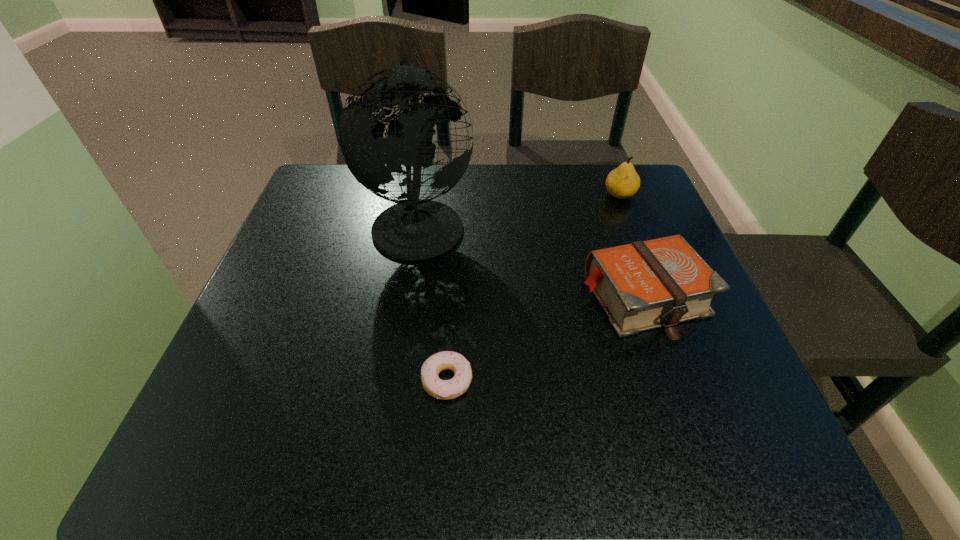
Locate an element on the screen. the tallest object is located at coordinates (x=413, y=229).

Locate an element on the screen. pear is located at coordinates (623, 182).

Find the location of a particular element. Bible is located at coordinates (643, 285).

This screenshot has width=960, height=540. Find the location of `the nearest object`. the nearest object is located at coordinates (449, 389).

You are a GUI agent. You are given a task and a screenshot of the screen. Output one action in this format:
    pyautogui.click(x=<x>, y=<y>)
    Task: Click on the doughnut
    This screenshot has width=960, height=540.
    Given the screenshot: What is the action you would take?
    pyautogui.click(x=449, y=389)

Locate an element on the screen. free space located on the front-facing side of the globe is located at coordinates (640, 222).

Find the location of a particular element. free space located 0.080m on the left of the second tallest object is located at coordinates (572, 195).

Locate an element on the screen. Image resolution: width=960 pixels, height=540 pixels. free space located 0.090m on the back of the Bible is located at coordinates (621, 233).

You are a GUI agent. You are given a task and a screenshot of the screen. Output one action in this format:
    pyautogui.click(x=<x>, y=<y>)
    Task: Click on the free region located 0.260m on the left of the shortest object
    The height and width of the screenshot is (540, 960).
    Given the screenshot: What is the action you would take?
    pyautogui.click(x=267, y=381)

Where is `globe that is at the far edge`? globe that is at the far edge is located at coordinates (413, 229).